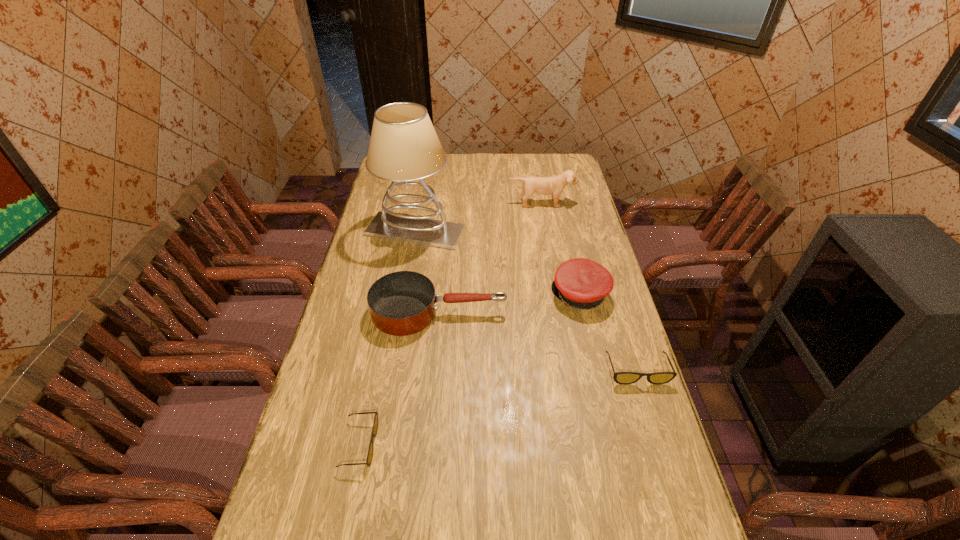
Image resolution: width=960 pixels, height=540 pixels. I want to click on free space located 0.300m on the front-facing side of the nearest object, so click(492, 444).

The image size is (960, 540). In order to click on free space located 0.140m on the front-facing side of the taller sunglasses in this screenshot , I will do 656,431.

Where is `vacant space located on the back of the fifth nearest object`? Image resolution: width=960 pixels, height=540 pixels. vacant space located on the back of the fifth nearest object is located at coordinates (420, 203).

You are a GUI agent. You are given a task and a screenshot of the screen. Output one action in this format:
    pyautogui.click(x=<x>, y=<y>)
    Task: Click on the free space located 0.310m on the handle side of the pan
    Image resolution: width=960 pixels, height=540 pixels.
    Given the screenshot: What is the action you would take?
    pyautogui.click(x=601, y=313)

At what (x,y) coordinates should I click in order to perform the action: click on free space located on the left side of the second tallest object. Please return your answer as a coordinate pair (x, y). The width and height of the screenshot is (960, 540). Looking at the image, I should click on (547, 236).

At what (x,y) coordinates should I click in order to perform the action: click on vacant point located 0.290m at the front of the cap where the visor is located. Please return your answer as a coordinate pair (x, y). The image size is (960, 540). Looking at the image, I should click on (468, 295).

This screenshot has width=960, height=540. I want to click on free location located at the front of the cap where the visor is located, so click(459, 295).

I want to click on vacant space located 0.060m at the front of the cap where the visor is located, so click(x=535, y=295).

Where is `sunglasses that is at the left edge`? The image size is (960, 540). sunglasses that is at the left edge is located at coordinates [375, 425].

Locate an element on the screen. The height and width of the screenshot is (540, 960). table lamp at the left edge is located at coordinates (404, 146).